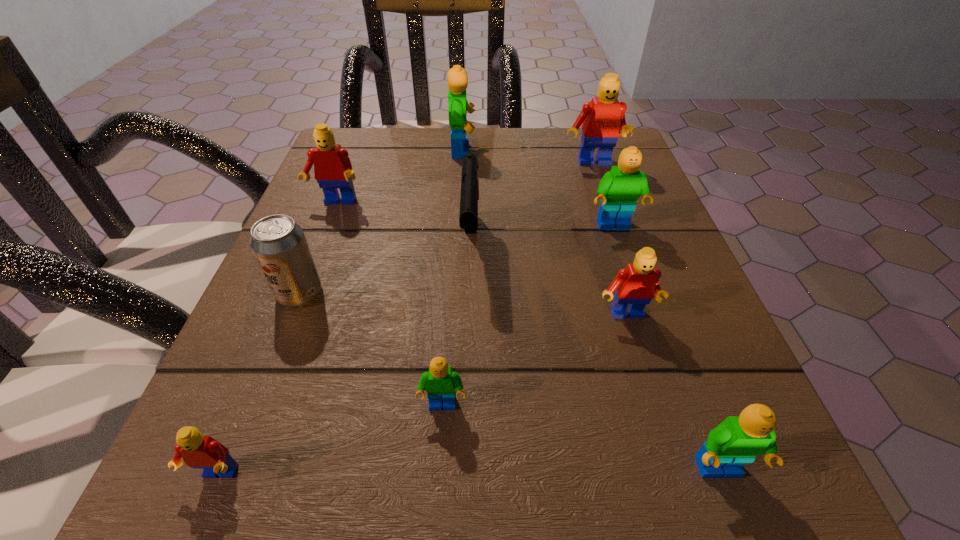
Identify the location of free space located on the front-facing side of the second smallest red Lego. The image size is (960, 540). (677, 491).

Where is `vacant space located on the face of the eighth farthest object`? vacant space located on the face of the eighth farthest object is located at coordinates (440, 458).

At what (x,y) coordinates should I click in order to perform the action: click on beer can situated at the left edge. Please return your answer as a coordinate pair (x, y). Image resolution: width=960 pixels, height=540 pixels. Looking at the image, I should click on (279, 244).

Find the location of `object that is at the near left corner`. object that is at the near left corner is located at coordinates (199, 452).

Identify the location of object present at the far right corner. [x=601, y=119].

This screenshot has height=540, width=960. Find the location of `object that is at the near right corner`. object that is at the near right corner is located at coordinates (737, 440).

The width and height of the screenshot is (960, 540). What are the coordinates of `vacant space at the far edge of the desktop` in the screenshot? It's located at (443, 164).

Identify the location of free space at the near edge of the desktop. (612, 498).

Image resolution: width=960 pixels, height=540 pixels. In the image, there is a desktop. In order to click on vacant space at the left edge in this screenshot , I will do `click(252, 367)`.

In the image, there is a desktop. Where is `vacant space at the right edge`? vacant space at the right edge is located at coordinates (633, 233).